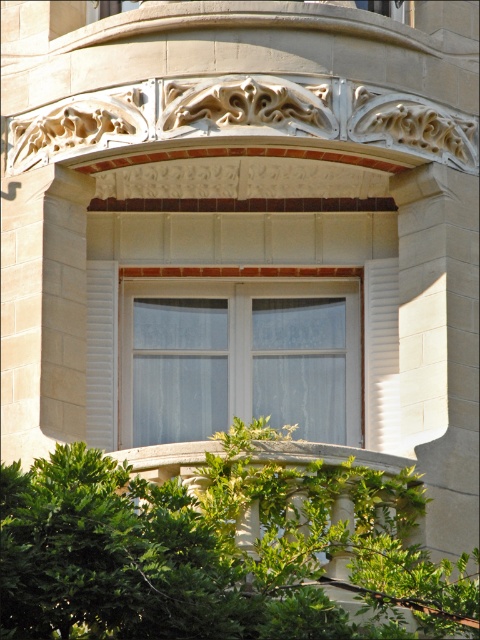
From the picture: Measure the distance from green leafy bush at lower center to white glass window at center.

A distance of 9.27 meters exists between green leafy bush at lower center and white glass window at center.

Is point (468, 609) positioned behind point (324, 339)?

No.

At what (x,y) coordinates should I click in order to perform the action: click on green leafy bush at lower center. Please return your answer as a coordinate pair (x, y). The height and width of the screenshot is (640, 480). Looking at the image, I should click on [x=214, y=550].

Where is `green leafy bush at lower center`? The width and height of the screenshot is (480, 640). green leafy bush at lower center is located at coordinates (214, 550).